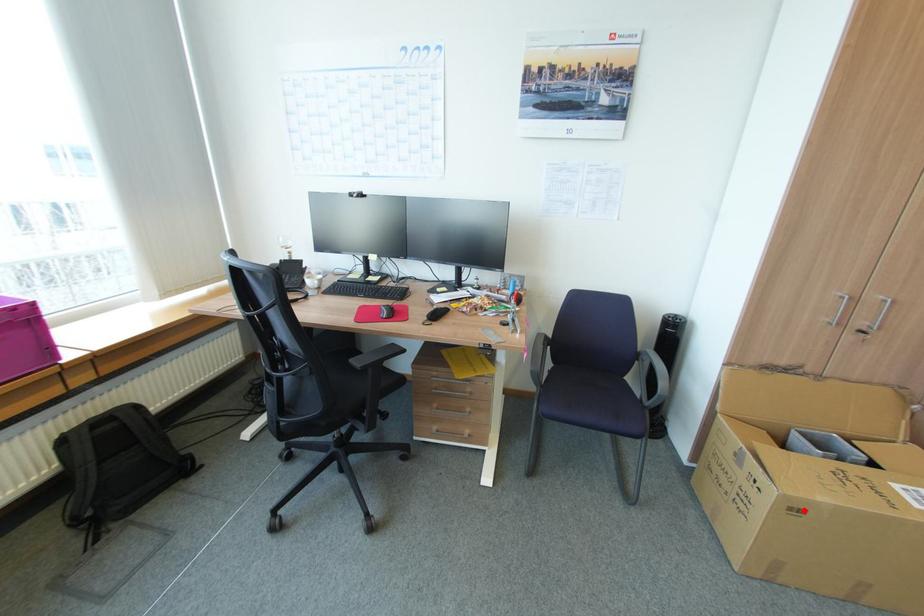
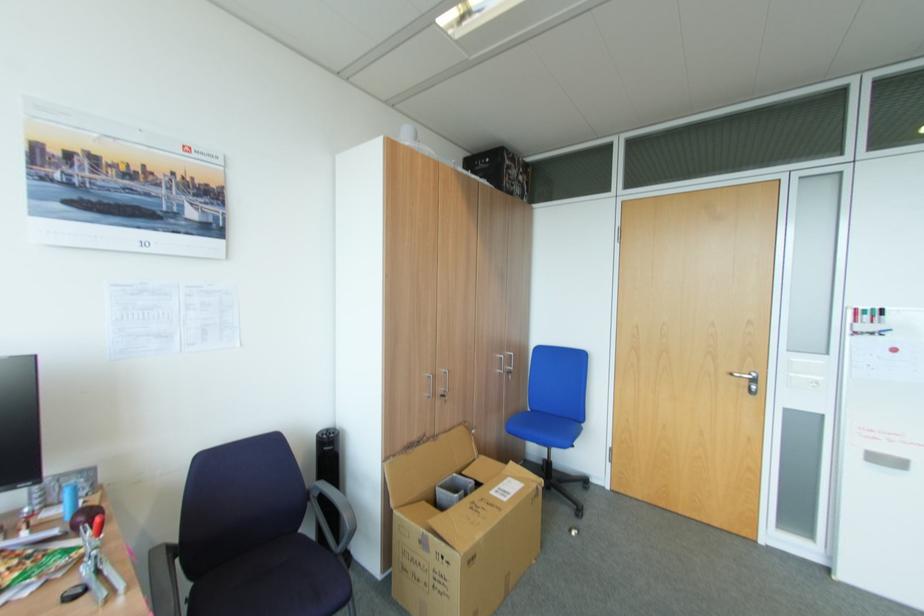
Where in the second image is the point corresponding to the highlighted location from the first image?

(479, 556)